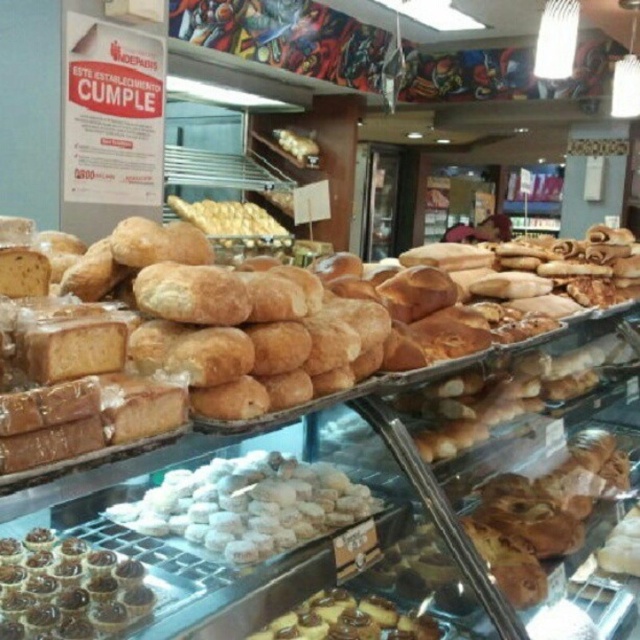
Who is positioned more to the left, white sugared cookies at center or chocolate glazed tartlets at lower left?

chocolate glazed tartlets at lower left

Does white sugared cookies at center lie behind chocolate glazed tartlets at lower left?

Yes, white sugared cookies at center is further from the viewer.

Who is more distant from viewer, (x=209, y=518) or (x=92, y=605)?

The point (x=209, y=518) is more distant.

The width and height of the screenshot is (640, 640). What are the coordinates of `white sugared cookies at center` in the screenshot? It's located at (248, 506).

Is white sugared cookies at center bigger than chocolate glazed pastry at lower center?

Yes, white sugared cookies at center is bigger than chocolate glazed pastry at lower center.

Describe the element at coordinates (248, 506) in the screenshot. I see `white sugared cookies at center` at that location.

Does point (141, 509) come in front of point (296, 616)?

Yes, point (141, 509) is in front of point (296, 616).

This screenshot has height=640, width=640. Find the location of `white sugared cookies at center`. white sugared cookies at center is located at coordinates (248, 506).

Can you confirm if golden brown crusty loaf at center is positioned above white sugared cookies at center?

Yes.

Can you confirm if golden brown crusty loaf at center is positioned below white sugared cookies at center?

No.

Which is in front, point (68, 403) or point (291, 509)?

Point (68, 403) is more forward.

Where is `golden brown crusty loaf at center`? golden brown crusty loaf at center is located at coordinates (234, 333).